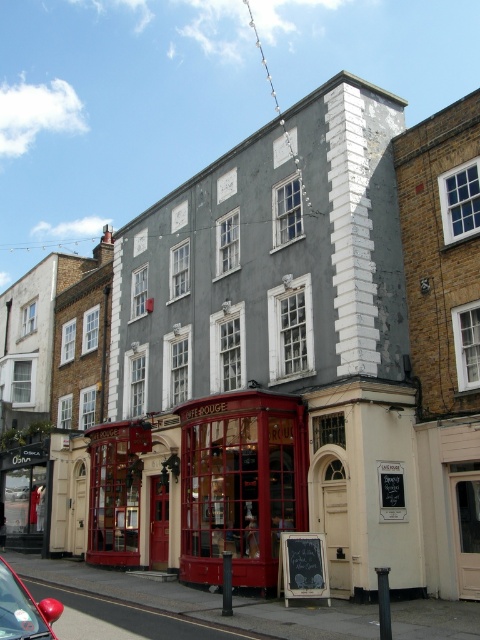
You are standing at the entrance of the building and want to locate the red glass storefront at center. According to the coordinates, where exactly is it positioned?

The red glass storefront at center is positioned at coordinates point (240, 483).

You are a delivery person trying to park your van next to the shiny red car at lower left and the red glass storefront at center. Based on their sizes, which one takes up more space?

The shiny red car at lower left takes up more space than the red glass storefront at center because the red glass storefront at center occupies less space than shiny red car at lower left.